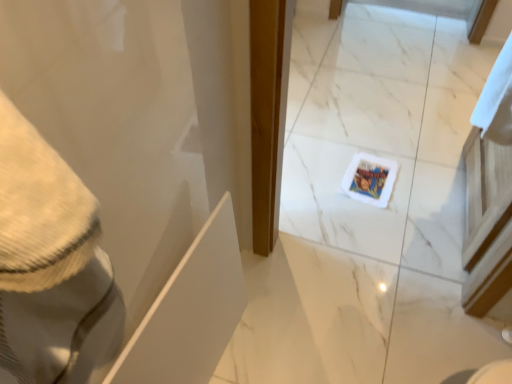
Identify the location of vacant region to the left of white plastic container at center. This screenshot has height=384, width=512. (322, 189).